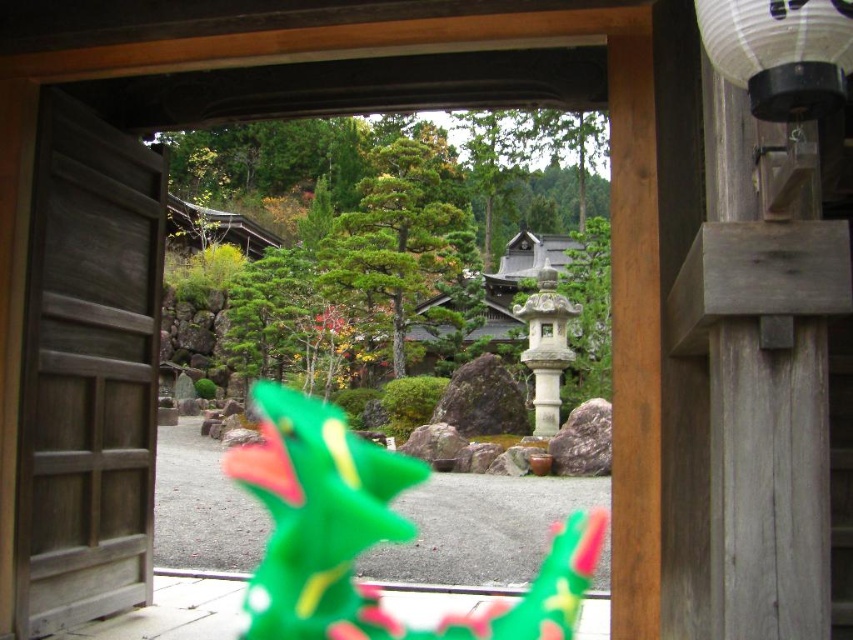
Question: Considering the relative positions of wooden door at left and green plastic dragon at center in the image provided, where is wooden door at left located with respect to green plastic dragon at center?

Choices:
 (A) above
 (B) below

Answer: (A)

Question: Among these objects, which one is farthest from the camera?

Choices:
 (A) wooden door at left
 (B) green plastic dragon at center

Answer: (B)

Question: Considering the relative positions of wooden door at left and white paper lantern at upper right in the image provided, where is wooden door at left located with respect to white paper lantern at upper right?

Choices:
 (A) right
 (B) left

Answer: (B)

Question: Where is wooden door at left located in relation to white paper lantern at upper right in the image?

Choices:
 (A) right
 (B) left

Answer: (B)

Question: Which object is positioned farthest from the wooden door at left?

Choices:
 (A) white paper lantern at upper right
 (B) green plastic dragon at center

Answer: (A)

Question: Among these points, which one is farthest from the camera?

Choices:
 (A) (563, 566)
 (B) (120, 394)
 (C) (782, 109)

Answer: (A)